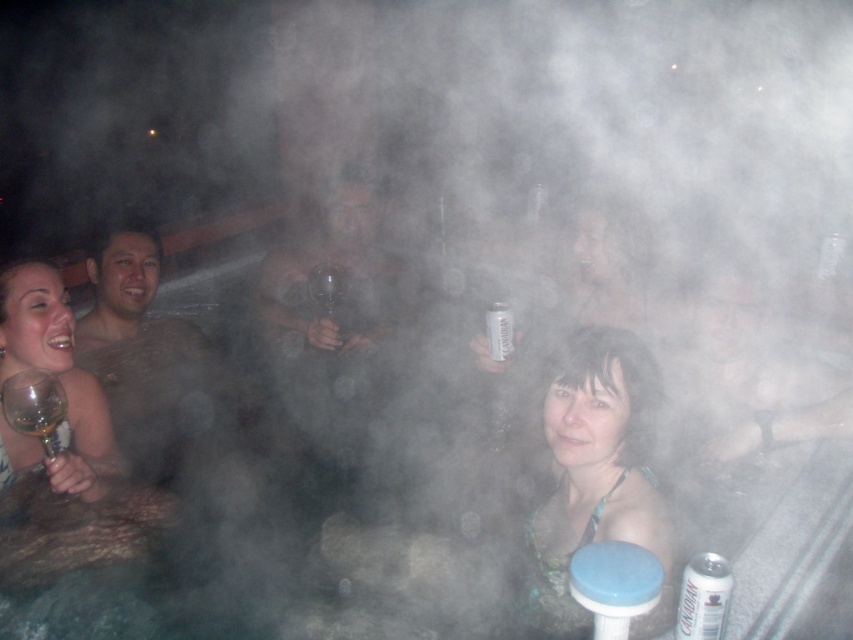
You are a photographer trying to capture a closeup of the matte green bikini top at center and the matte skin at center in the hot tub scene. If your camera can focus on objects within a 5 feet range, will both subjects be in focus?

The matte green bikini top at center is 5.54 feet away from matte skin at center. Since the camera can focus within 5 feet, the distance between them is beyond the focus range. Therefore, only one subject can be in focus at a time.

You are a photographer trying to capture a clear shot of the matte green bikini top at center and the translucent glass wine glass at lower left. Since the steam is thick, you need to adjust your focus. Which object should you focus on first to ensure it appears sharp in the photo?

The matte green bikini top at center is closer to the viewer than the translucent glass wine glass at lower left, so you should focus on the matte green bikini top at center first to ensure it appears sharp in the photo.

You are a photographer trying to capture a candid shot of the matte green bikini top at center and the translucent glass wine glass at lower left. From the current angle, which object is positioned more to the right?

The matte green bikini top at center is positioned to the right of the translucent glass wine glass at lower left, so the matte green bikini top at center is more to the right.